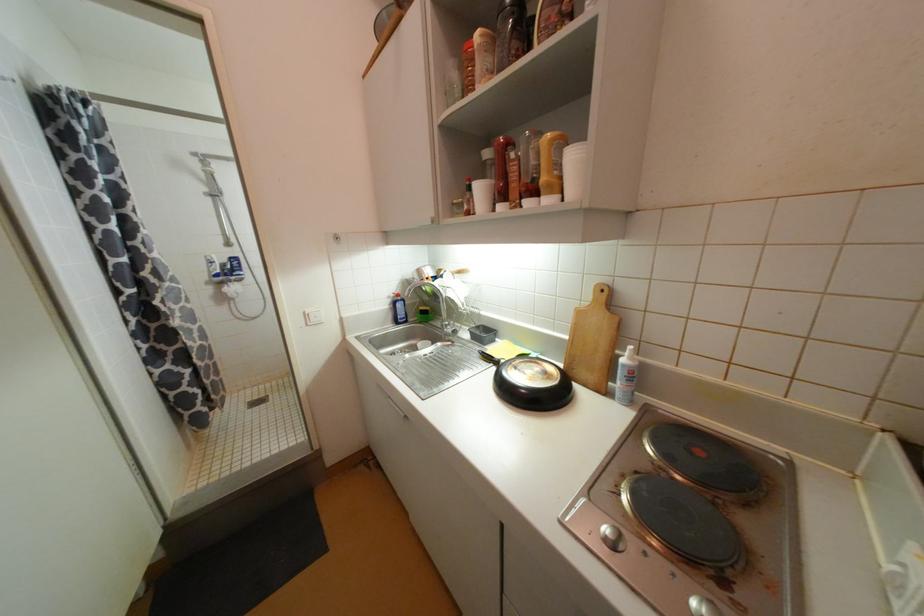
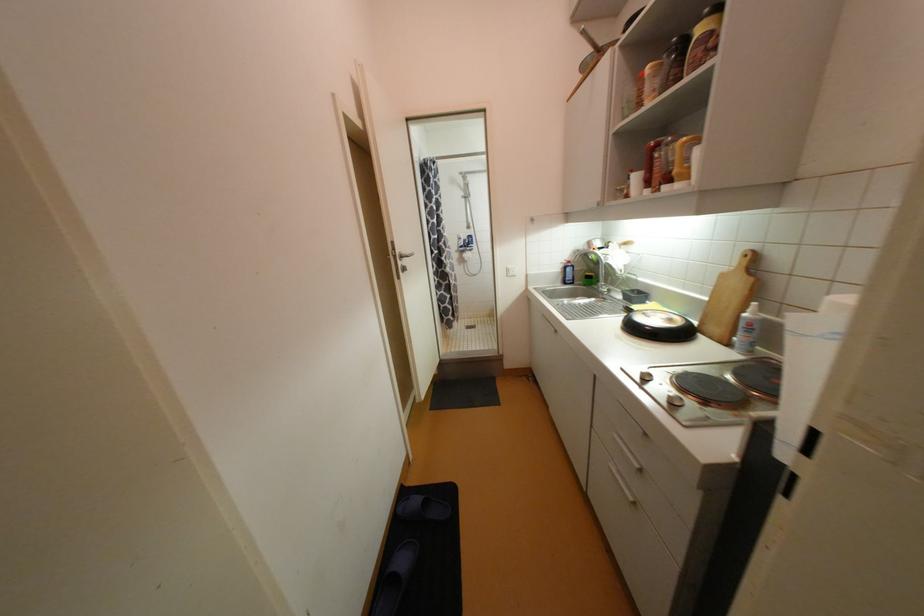
In the second image, find the point that corresponds to [541,193] in the first image.

(675, 180)